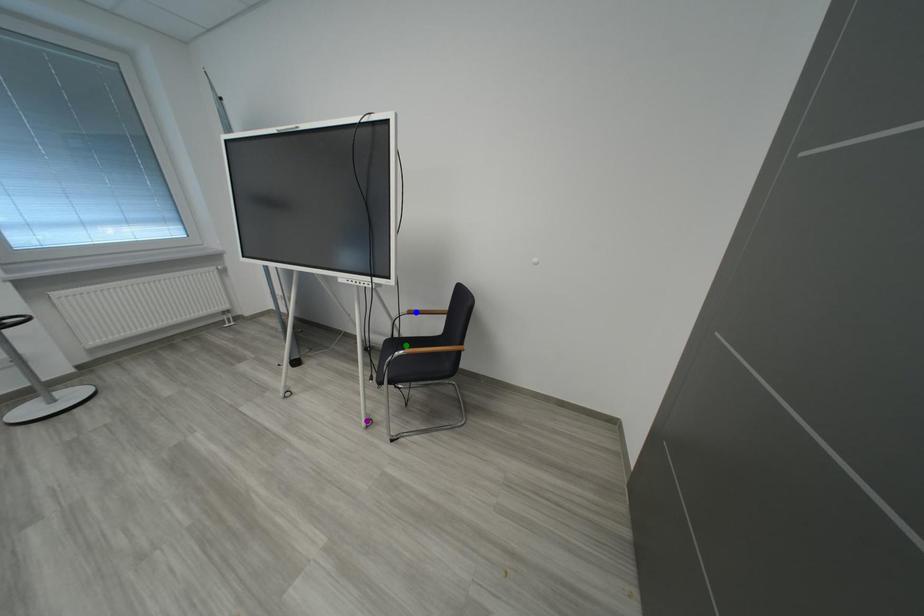
Order these from nearest to farthest:
blue point | purple point | green point

purple point
green point
blue point